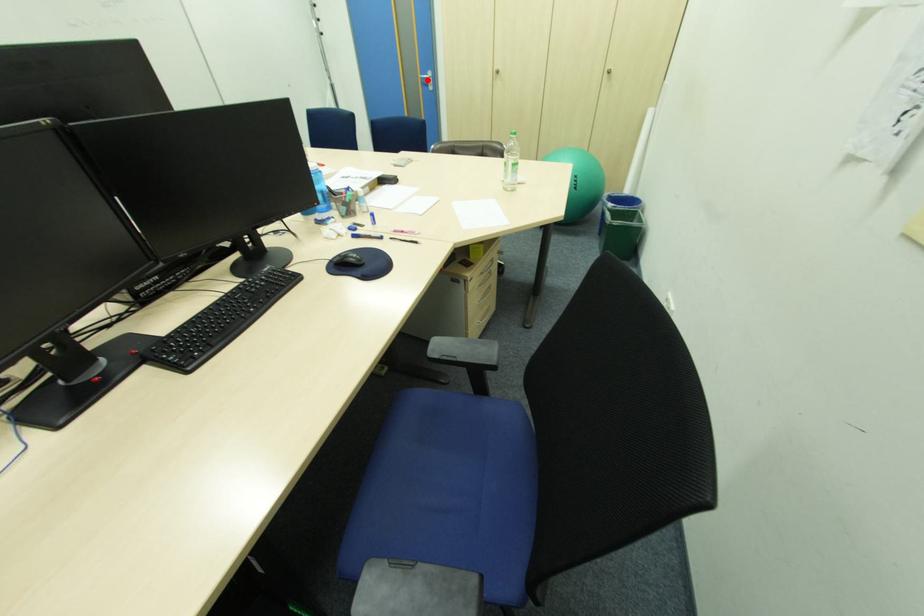
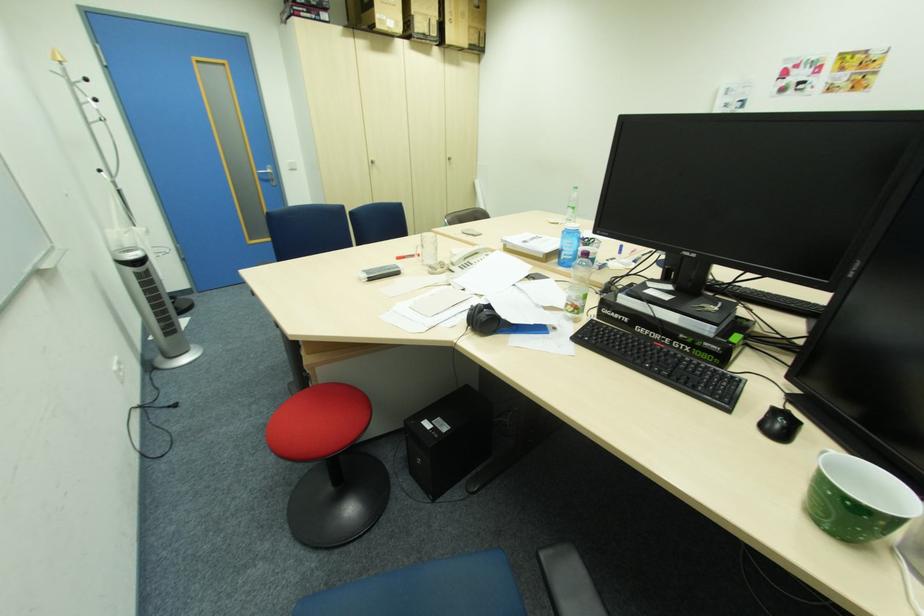
The point at the highlighted location is marked in the first image. Where is the corresponding point in the second image?

(264, 174)